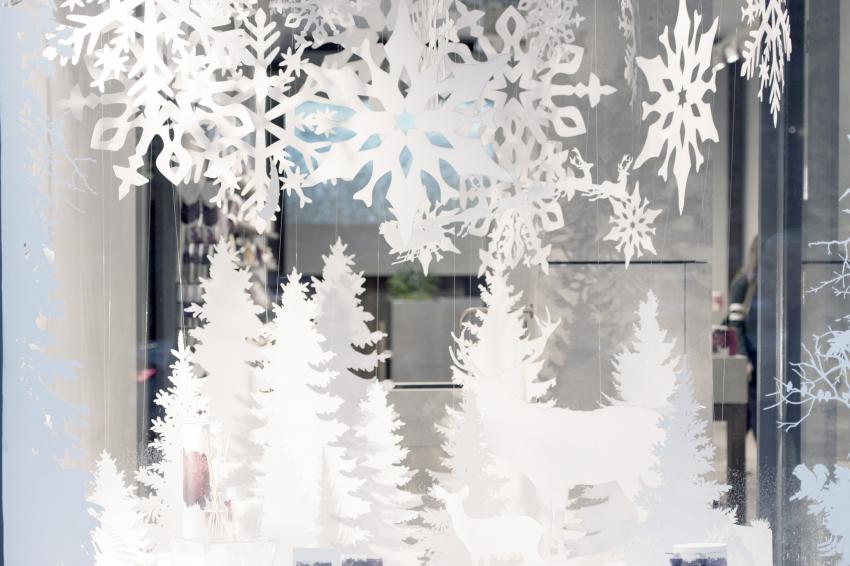
Locate an element on the screen. The width and height of the screenshot is (850, 566). dark grey metal exposed beam is located at coordinates (785, 208).